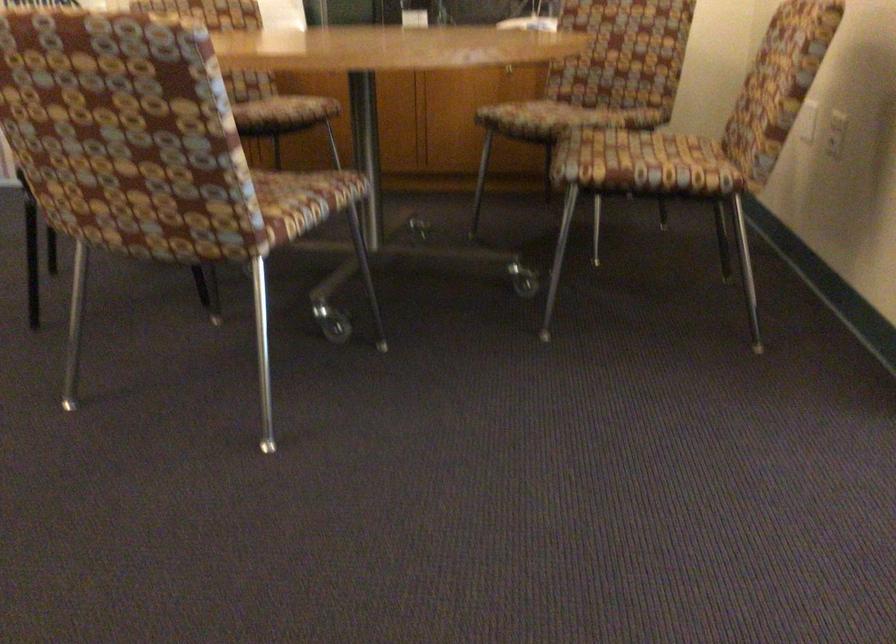
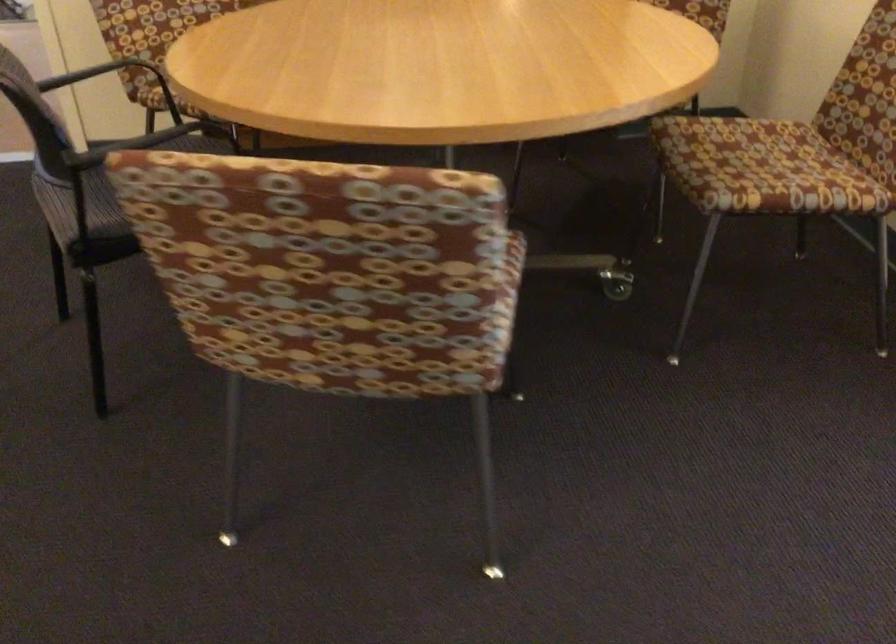
Question: I am providing you with two images of the same scene from different viewpoints. Which of the following objects are not visible in image2?

Choices:
 (A) black chair armrest
 (B) chair sitting surface
 (C) black chair sitting surface
 (D) gray sofa sitting surface

Answer: (B)